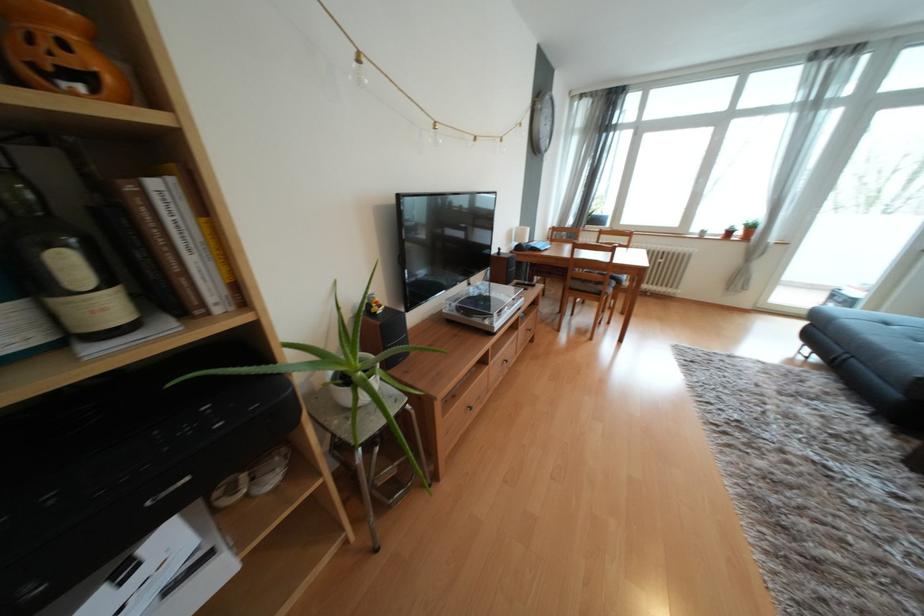
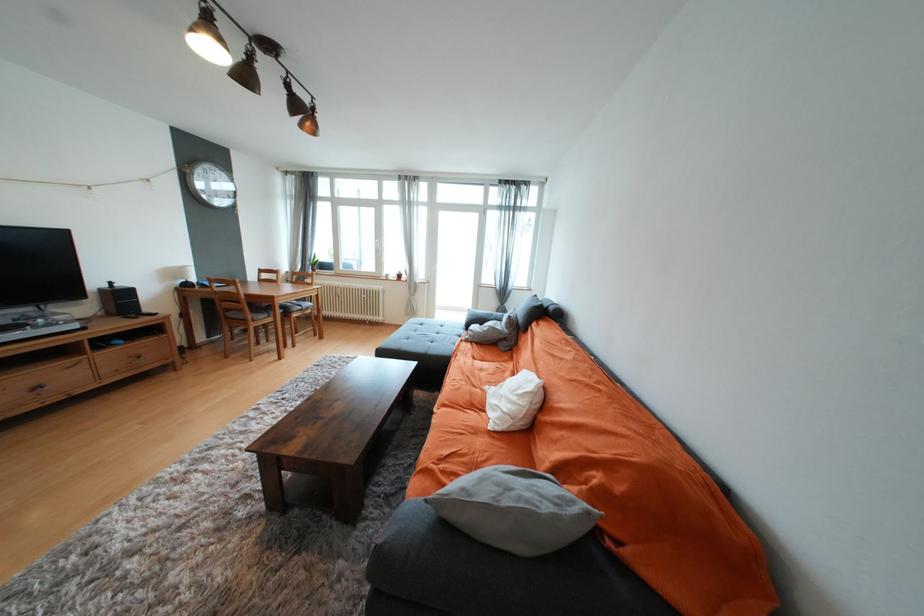
In the second image, find the point that corresponds to pixel 513 363 in the first image.

(44, 387)